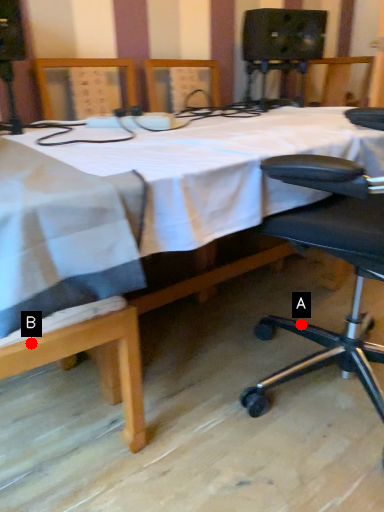
Question: Two points are circled on the image, labeled by A and B beside each circle. Which point is closer to the camera taking this photo?

Choices:
 (A) A is closer
 (B) B is closer

Answer: (B)